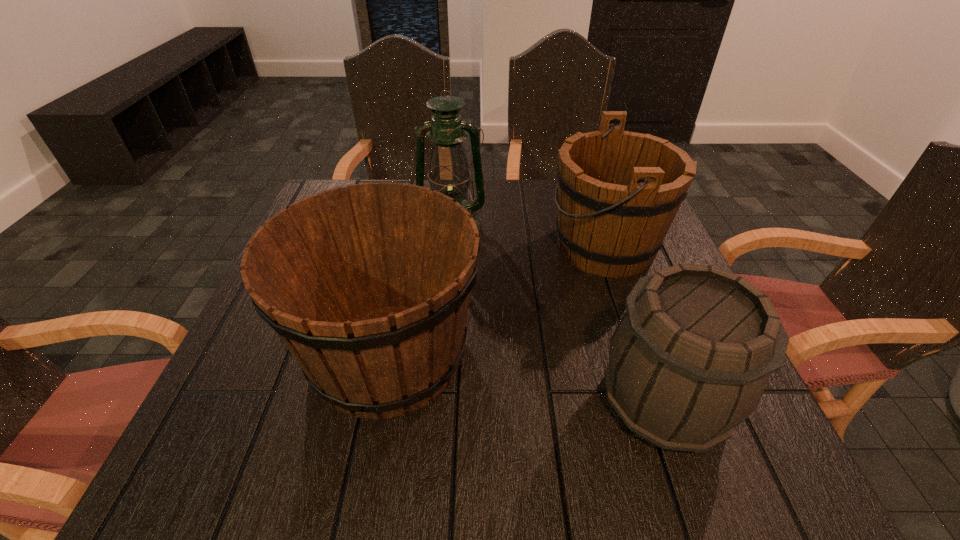
The height and width of the screenshot is (540, 960). Identify the location of the tallest object. (449, 173).

Identify the location of the farthest wine bucket. The width and height of the screenshot is (960, 540). (618, 191).

Where is `the leftmost wine bucket`? Image resolution: width=960 pixels, height=540 pixels. the leftmost wine bucket is located at coordinates (368, 286).

Find the location of a particular element. The width and height of the screenshot is (960, 540). vacant space situated 0.210m on the right of the tallest object is located at coordinates (564, 224).

Where is `vacant area situated 0.260m on the side of the farthest wine bucket with the handle for carrying`? This screenshot has width=960, height=540. vacant area situated 0.260m on the side of the farthest wine bucket with the handle for carrying is located at coordinates (444, 246).

At what (x,y) coordinates should I click in order to perform the action: click on vacant space positioned on the side of the farthest wine bucket with the handle for carrying. Please return your answer as a coordinate pair (x, y). Looking at the image, I should click on (411, 246).

This screenshot has height=540, width=960. What are the coordinates of `vacant area located on the side of the farthest wine bucket with the handle for carrying` in the screenshot? It's located at (386, 246).

Locate an element on the screen. The image size is (960, 540). vacant area situated on the right of the leftmost wine bucket is located at coordinates (575, 353).

Find the location of `oil lamp located at the far edge`. oil lamp located at the far edge is located at coordinates (449, 173).

Locate an element on the screen. The height and width of the screenshot is (540, 960). wine bucket situated at the far edge is located at coordinates (618, 191).